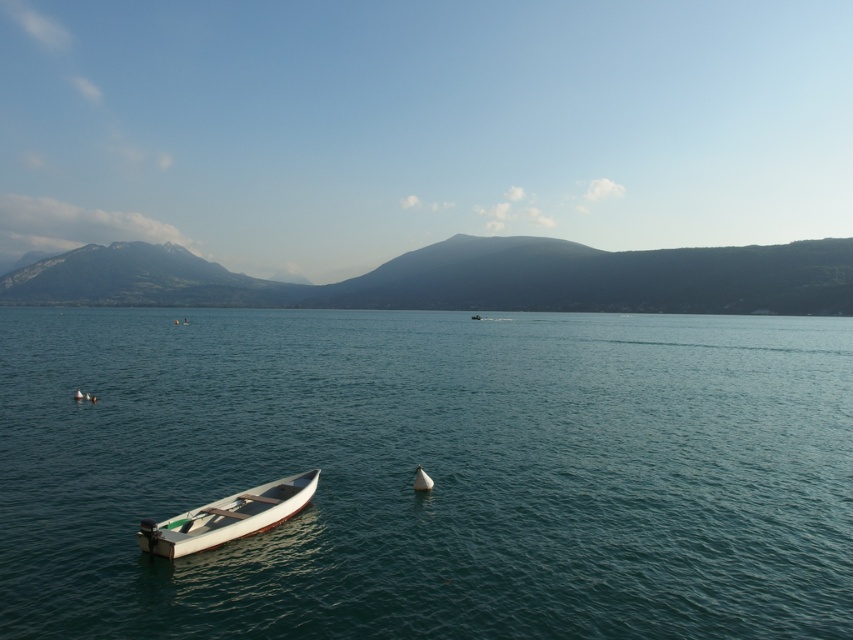
Question: Where is white matte sailboat at center located in relation to white matte boat at center in the image?

Choices:
 (A) below
 (B) above

Answer: (A)

Question: Which of the following is the closest to the observer?

Choices:
 (A) [547, 280]
 (B) [764, 508]
 (C) [474, 316]

Answer: (B)

Question: Which point is closer to the camera?

Choices:
 (A) green textured mountain at center
 (B) white matte boat at center
 (C) white matte sailboat at center

Answer: (C)

Question: Considering the relative positions of green textured mountain at center and white matte boat at center in the image provided, where is green textured mountain at center located with respect to white matte boat at center?

Choices:
 (A) right
 (B) left

Answer: (B)

Question: Is green textured mountain at center positioned before white matte boat at center?

Choices:
 (A) no
 (B) yes

Answer: (A)

Question: Estimate the real-world distances between objects in this image. Which object is farther from the green smooth water at center?

Choices:
 (A) white matte boat at lower left
 (B) green textured mountain at center
 (C) white matte boat at center
 (D) white matte sailboat at center

Answer: (B)